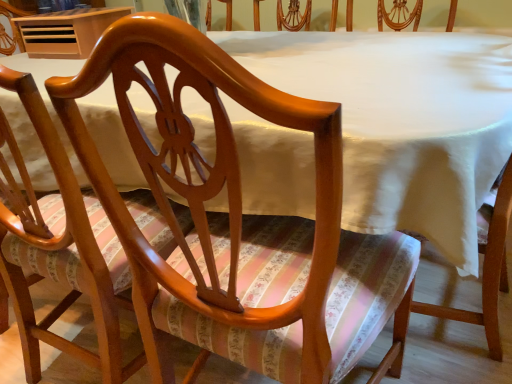
Question: From the image's perspective, is glossy wood chair at center, placed as the 1th chair when sorted from left to right, below wooden table at upper left?

Choices:
 (A) no
 (B) yes

Answer: (B)

Question: Can you confirm if glossy wood chair at center, placed as the 1th chair when sorted from left to right, is bigger than wooden table at upper left?

Choices:
 (A) yes
 (B) no

Answer: (A)

Question: From a real-world perspective, is glossy wood chair at center, arranged as the 2th chair when viewed from the right, physically above wooden table at upper left?

Choices:
 (A) yes
 (B) no

Answer: (B)

Question: Is glossy wood chair at center, placed as the 1th chair when sorted from left to right, at the right side of wooden table at upper left?

Choices:
 (A) no
 (B) yes

Answer: (B)

Question: Is wooden table at upper left surrounded by glossy wood chair at center, placed as the 1th chair when sorted from left to right?

Choices:
 (A) no
 (B) yes

Answer: (A)

Question: Looking at their shapes, would you say glossy wood chair at center, the 2th chair in the left-to-right sequence, is wider or thinner than glossy wood chair at center, arranged as the 2th chair when viewed from the right?

Choices:
 (A) wide
 (B) thin

Answer: (A)

Question: In the image, is glossy wood chair at center, the 2th chair in the left-to-right sequence, on the left side or the right side of glossy wood chair at center, placed as the 1th chair when sorted from left to right?

Choices:
 (A) left
 (B) right

Answer: (B)

Question: Considering the positions of glossy wood chair at center, the first chair viewed from the right, and glossy wood chair at center, arranged as the 2th chair when viewed from the right, in the image, is glossy wood chair at center, the first chair viewed from the right, taller or shorter than glossy wood chair at center, arranged as the 2th chair when viewed from the right,?

Choices:
 (A) short
 (B) tall

Answer: (A)

Question: Relative to glossy wood chair at center, arranged as the 2th chair when viewed from the right, is glossy wood chair at center, the first chair viewed from the right, in front or behind?

Choices:
 (A) front
 (B) behind

Answer: (A)

Question: Considering the positions of wooden table at upper left and glossy wood chair at center, arranged as the 2th chair when viewed from the right, in the image, is wooden table at upper left taller or shorter than glossy wood chair at center, arranged as the 2th chair when viewed from the right,?

Choices:
 (A) tall
 (B) short

Answer: (B)

Question: From a real-world perspective, is wooden table at upper left positioned above or below glossy wood chair at center, placed as the 1th chair when sorted from left to right?

Choices:
 (A) below
 (B) above

Answer: (B)

Question: Considering their positions, is wooden table at upper left located in front of or behind glossy wood chair at center, arranged as the 2th chair when viewed from the right?

Choices:
 (A) front
 (B) behind

Answer: (B)

Question: Is wooden table at upper left bigger or smaller than glossy wood chair at center, placed as the 1th chair when sorted from left to right?

Choices:
 (A) small
 (B) big

Answer: (A)

Question: Would you say glossy wood chair at center, arranged as the 2th chair when viewed from the right, is inside or outside wooden table at upper left?

Choices:
 (A) outside
 (B) inside

Answer: (A)

Question: Is point (86, 246) positioned closer to the camera than point (75, 56)?

Choices:
 (A) closer
 (B) farther

Answer: (A)